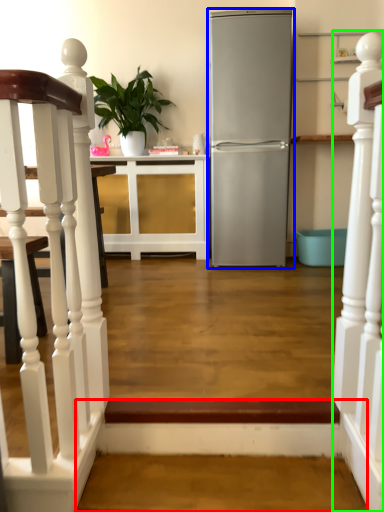
Question: Which object is the farthest from stairwell (highlighted by a red box)? Choose among these: refrigerator (highlighted by a blue box) or rail (highlighted by a green box).

Choices:
 (A) refrigerator
 (B) rail

Answer: (A)